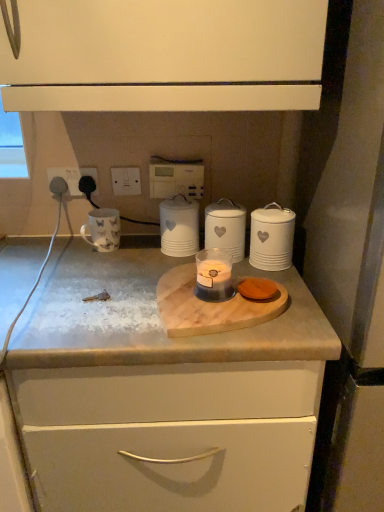
Question: From the image's perspective, is translucent glass candle at center above or below black plastic socket at upper left, the 2th electric outlet from the right?

Choices:
 (A) above
 (B) below

Answer: (B)

Question: From a real-world perspective, is translucent glass candle at center positioned above or below black plastic socket at upper left, positioned as the second electric outlet in left-to-right order?

Choices:
 (A) above
 (B) below

Answer: (B)

Question: Considering the real-world distances, which object is farthest from the white textured canister at center, positioned as the second home appliance in right-to-left order?

Choices:
 (A) white plastic socket at upper left, the 1th electric outlet viewed from the left
 (B) translucent glass candle at center
 (C) white plastic switch at upper center, the first electric outlet in the right-to-left sequence
 (D) white matte canister at right, the first home appliance when ordered from right to left
 (E) white matte canister at center, which is counted as the 3th home appliance, starting from the right

Answer: (A)

Question: Considering the real-world distances, which object is farthest from the white plastic switch at upper center, positioned as the 3th electric outlet in left-to-right order?

Choices:
 (A) white plastic socket at upper left, positioned as the third electric outlet in right-to-left order
 (B) translucent glass candle at center
 (C) white matte canister at center, which is the first home appliance in left-to-right order
 (D) black plastic socket at upper left, positioned as the second electric outlet in left-to-right order
 (E) white textured canister at center, positioned as the second home appliance in right-to-left order

Answer: (B)